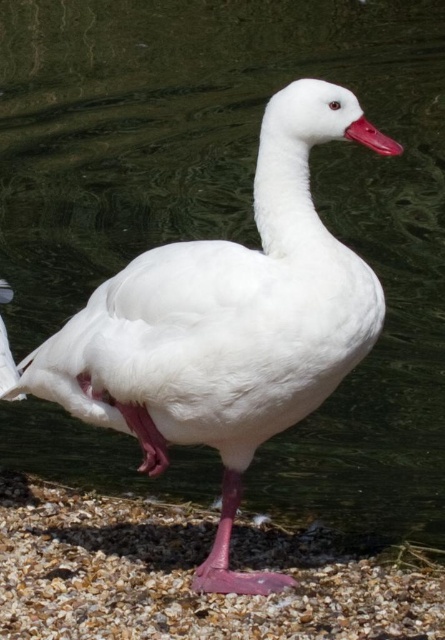
You are standing at the edge of the water and notice the smooth gravel at lower center. Based on its coordinates, can you determine if it is closer to the water or further away from it?

The smooth gravel at lower center is located at point (190, 573), which places it closer to the water since the coordinates suggest it is positioned near the lower part of the image where the water is located.

You are a photographer trying to capture the white duck. You notice the matte pink beak at center and the smooth gravel at lower center. Which object is closer to the camera? Please explain your reasoning based on their positions.

The smooth gravel at lower center is closer to the camera than the matte pink beak at center because the matte pink beak at center is positioned behind the smooth gravel at lower center.

You are a photographer trying to capture the white duck. You notice the smooth gravel at lower center and the matte pink beak at center. Which object is positioned to the left of the other?

The smooth gravel at lower center is to the left of matte pink beak at center.